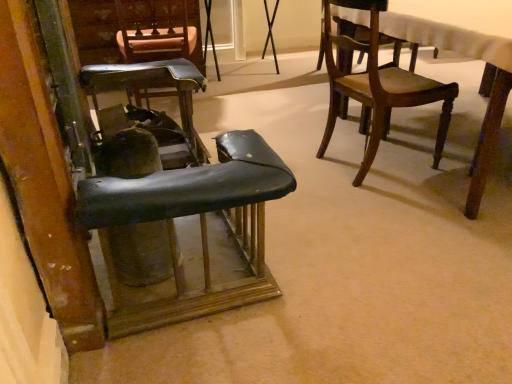
The height and width of the screenshot is (384, 512). What are the coordinates of `leather-like brown chair at upper center, which is the 4th chair in right-to-left order` in the screenshot? It's located at (x=157, y=31).

Looking at this image, what is the approximate width of leather-like brown chair at upper center, which is the 1th chair from left to right?

The width of leather-like brown chair at upper center, which is the 1th chair from left to right, is 20.88 inches.

This screenshot has width=512, height=384. I want to click on leather-like black chair at left, the second chair positioned from the right, so click(200, 228).

How much space does leather-like black chair at center-left, which ranks as the second chair in left-to-right order, occupy horizontally?

18.32 inches.

Find the location of a particular element. The height and width of the screenshot is (384, 512). leather-like brown chair at upper center, which is the 1th chair from left to right is located at coordinates (157, 31).

Is wooden chair at upper right, which is the 4th chair from left to right, next to leather-like brown chair at upper center, which is the 4th chair in right-to-left order?

There is a gap between wooden chair at upper right, which is the 4th chair from left to right, and leather-like brown chair at upper center, which is the 4th chair in right-to-left order.

Is wooden chair at upper right, which is the 4th chair from left to right, at the left side of leather-like brown chair at upper center, which is the 1th chair from left to right?

In fact, wooden chair at upper right, which is the 4th chair from left to right, is to the right of leather-like brown chair at upper center, which is the 1th chair from left to right.

Consider the image. Is wooden chair at upper right, the 1th chair from the right, spatially inside leather-like brown chair at upper center, which is the 1th chair from left to right, or outside of it?

wooden chair at upper right, the 1th chair from the right, is spatially situated outside leather-like brown chair at upper center, which is the 1th chair from left to right.

Which is in front, point (353, 82) or point (183, 33)?

The point (353, 82) is closer.

Would you say leather-like black chair at left, the second chair positioned from the right, is a long distance from leather-like black chair at center-left, which ranks as the second chair in left-to-right order?

No, there isn't a large distance between leather-like black chair at left, the second chair positioned from the right, and leather-like black chair at center-left, which ranks as the second chair in left-to-right order.

Between leather-like black chair at left, which is counted as the third chair, starting from the left, and leather-like black chair at center-left, the 3th chair positioned from the right, which one has smaller size?

leather-like black chair at center-left, the 3th chair positioned from the right.

How distant is leather-like black chair at left, the second chair positioned from the right, from leather-like black chair at center-left, the 3th chair positioned from the right?

leather-like black chair at left, the second chair positioned from the right, and leather-like black chair at center-left, the 3th chair positioned from the right, are 95.34 centimeters apart from each other.

From a real-world perspective, is leather-like black chair at left, which is counted as the third chair, starting from the left, on top of leather-like black chair at center-left, which ranks as the second chair in left-to-right order?

Indeed, from a real-world perspective, leather-like black chair at left, which is counted as the third chair, starting from the left, stands above leather-like black chair at center-left, which ranks as the second chair in left-to-right order.

From the picture: Could you measure the distance between leather-like black chair at center-left, which ranks as the second chair in left-to-right order, and leather-like black chair at left, which is counted as the third chair, starting from the left?

leather-like black chair at center-left, which ranks as the second chair in left-to-right order, and leather-like black chair at left, which is counted as the third chair, starting from the left, are 37.54 inches apart.

Does leather-like black chair at center-left, the 3th chair positioned from the right, have a greater width compared to leather-like black chair at left, the second chair positioned from the right?

No, leather-like black chair at center-left, the 3th chair positioned from the right, is not wider than leather-like black chair at left, the second chair positioned from the right.

From the image's perspective, relative to leather-like black chair at left, the second chair positioned from the right, is leather-like black chair at center-left, which ranks as the second chair in left-to-right order, above or below?

Based on their image positions, leather-like black chair at center-left, which ranks as the second chair in left-to-right order, is located above leather-like black chair at left, the second chair positioned from the right.

Is point (103, 130) positioned behind point (265, 197)?

Yes, it is.

Is wooden chair at upper right, the 1th chair from the right, not close to leather-like black chair at left, which is counted as the third chair, starting from the left?

No, wooden chair at upper right, the 1th chair from the right, is not far away from leather-like black chair at left, which is counted as the third chair, starting from the left.

Based on the photo, between wooden chair at upper right, the 1th chair from the right, and leather-like black chair at left, which is counted as the third chair, starting from the left, which one has larger width?

Wider between the two is leather-like black chair at left, which is counted as the third chair, starting from the left.

Is point (388, 67) positioned after point (95, 209)?

Yes.

Considering the relative positions of wooden chair at upper right, the 1th chair from the right, and leather-like black chair at left, the second chair positioned from the right, in the image provided, is wooden chair at upper right, the 1th chair from the right, to the left of leather-like black chair at left, the second chair positioned from the right, from the viewer's perspective?

Incorrect, wooden chair at upper right, the 1th chair from the right, is not on the left side of leather-like black chair at left, the second chair positioned from the right.

Based on the photo, considering the sizes of objects wooden chair at upper right, the 1th chair from the right, and leather-like black chair at center-left, which ranks as the second chair in left-to-right order, in the image provided, who is bigger, wooden chair at upper right, the 1th chair from the right, or leather-like black chair at center-left, which ranks as the second chair in left-to-right order,?

wooden chair at upper right, the 1th chair from the right.

What's the angular difference between wooden chair at upper right, which is the 4th chair from left to right, and leather-like black chair at center-left, which ranks as the second chair in left-to-right order,'s facing directions?

There is a 6.99-degree angle between the facing directions of wooden chair at upper right, which is the 4th chair from left to right, and leather-like black chair at center-left, which ranks as the second chair in left-to-right order.

Between wooden chair at upper right, the 1th chair from the right, and leather-like black chair at center-left, the 3th chair positioned from the right, which one has larger width?

Wider between the two is wooden chair at upper right, the 1th chair from the right.

Does wooden chair at upper right, which is the 4th chair from left to right, have a greater height compared to leather-like black chair at center-left, the 3th chair positioned from the right?

Correct, wooden chair at upper right, which is the 4th chair from left to right, is much taller as leather-like black chair at center-left, the 3th chair positioned from the right.

Considering the relative positions of leather-like brown chair at upper center, which is the 4th chair in right-to-left order, and wooden chair at upper right, which is the 4th chair from left to right, in the image provided, is leather-like brown chair at upper center, which is the 4th chair in right-to-left order, behind wooden chair at upper right, which is the 4th chair from left to right,?

Yes, leather-like brown chair at upper center, which is the 4th chair in right-to-left order, is further from the camera.

Is leather-like brown chair at upper center, which is the 1th chair from left to right, far away from wooden chair at upper right, the 1th chair from the right?

Absolutely, leather-like brown chair at upper center, which is the 1th chair from left to right, is distant from wooden chair at upper right, the 1th chair from the right.

From a real-world perspective, which is physically below, leather-like brown chair at upper center, which is the 1th chair from left to right, or wooden chair at upper right, which is the 4th chair from left to right?

From a 3D spatial view, leather-like brown chair at upper center, which is the 1th chair from left to right, is below.

In terms of size, does leather-like brown chair at upper center, which is the 4th chair in right-to-left order, appear bigger or smaller than wooden chair at upper right, the 1th chair from the right?

Considering their sizes, leather-like brown chair at upper center, which is the 4th chair in right-to-left order, takes up less space than wooden chair at upper right, the 1th chair from the right.

Which object is positioned more to the left, leather-like black chair at left, which is counted as the third chair, starting from the left, or wooden chair at upper right, which is the 4th chair from left to right?

leather-like black chair at left, which is counted as the third chair, starting from the left.

From the image's perspective, between leather-like black chair at left, the second chair positioned from the right, and wooden chair at upper right, which is the 4th chair from left to right, which one is located above?

From the image's view, wooden chair at upper right, which is the 4th chair from left to right, is above.

Choose the correct answer: Is leather-like black chair at left, which is counted as the third chair, starting from the left, inside wooden chair at upper right, the 1th chair from the right, or outside it?

leather-like black chair at left, which is counted as the third chair, starting from the left, exists outside the volume of wooden chair at upper right, the 1th chair from the right.

Which object is wider, leather-like black chair at left, which is counted as the third chair, starting from the left, or wooden chair at upper right, the 1th chair from the right?

leather-like black chair at left, which is counted as the third chair, starting from the left, is wider.

From a real-world perspective, starting from the wooden chair at upper right, which is the 4th chair from left to right, which chair is the 1st one below it? Please provide its 2D coordinates.

[(157, 31)]

Locate an element on the screen. the 1st chair above when counting from the leather-like black chair at left, the second chair positioned from the right (from the image's perspective) is located at coordinates (149, 104).

From the picture: Considering their positions, is wooden chair at upper right, which is the 4th chair from left to right, positioned closer to leather-like brown chair at upper center, which is the 1th chair from left to right, than leather-like black chair at center-left, the 3th chair positioned from the right?

leather-like black chair at center-left, the 3th chair positioned from the right, is closer to leather-like brown chair at upper center, which is the 1th chair from left to right.

Consider the image. Estimate the real-world distances between objects in this image. Which object is closer to leather-like black chair at center-left, which ranks as the second chair in left-to-right order, leather-like brown chair at upper center, which is the 4th chair in right-to-left order, or leather-like black chair at left, which is counted as the third chair, starting from the left?

leather-like brown chair at upper center, which is the 4th chair in right-to-left order, is closer to leather-like black chair at center-left, which ranks as the second chair in left-to-right order.

Considering their positions, is leather-like brown chair at upper center, which is the 1th chair from left to right, positioned further to wooden chair at upper right, which is the 4th chair from left to right, than leather-like black chair at center-left, which ranks as the second chair in left-to-right order?

Based on the image, leather-like brown chair at upper center, which is the 1th chair from left to right, appears to be further to wooden chair at upper right, which is the 4th chair from left to right.

Based on their spatial positions, is leather-like black chair at left, which is counted as the third chair, starting from the left, or wooden chair at upper right, which is the 4th chair from left to right, further from leather-like brown chair at upper center, which is the 4th chair in right-to-left order?

leather-like black chair at left, which is counted as the third chair, starting from the left, is positioned further to the anchor leather-like brown chair at upper center, which is the 4th chair in right-to-left order.

Which object lies nearer to the anchor point wooden chair at upper right, the 1th chair from the right, leather-like black chair at left, the second chair positioned from the right, or leather-like brown chair at upper center, which is the 4th chair in right-to-left order?

leather-like black chair at left, the second chair positioned from the right, is positioned closer to the anchor wooden chair at upper right, the 1th chair from the right.

When comparing their distances from leather-like black chair at center-left, the 3th chair positioned from the right, does leather-like black chair at left, which is counted as the third chair, starting from the left, or wooden chair at upper right, which is the 4th chair from left to right, seem closer?

wooden chair at upper right, which is the 4th chair from left to right.

Estimate the real-world distances between objects in this image. Which object is closer to wooden chair at upper right, which is the 4th chair from left to right, leather-like brown chair at upper center, which is the 1th chair from left to right, or leather-like black chair at left, which is counted as the third chair, starting from the left?

leather-like black chair at left, which is counted as the third chair, starting from the left.

From the image, which object appears to be farther from leather-like black chair at center-left, which ranks as the second chair in left-to-right order, wooden chair at upper right, which is the 4th chair from left to right, or leather-like black chair at left, which is counted as the third chair, starting from the left?

leather-like black chair at left, which is counted as the third chair, starting from the left, is further to leather-like black chair at center-left, which ranks as the second chair in left-to-right order.

The height and width of the screenshot is (384, 512). In order to click on chair between leather-like black chair at center-left, the 3th chair positioned from the right, and wooden chair at upper right, which is the 4th chair from left to right, from left to right in this screenshot , I will do `click(200, 228)`.